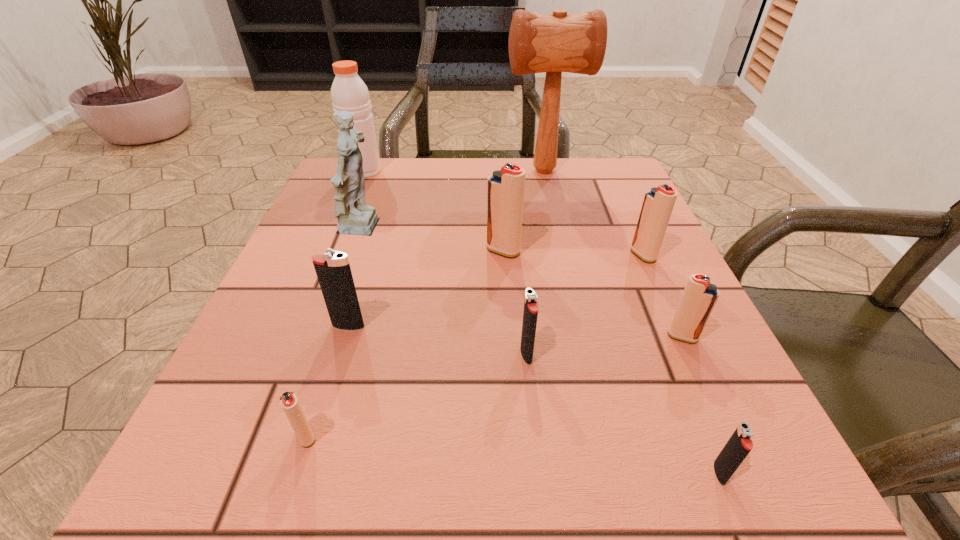
Find the location of a particular element. Image resolution: width=960 pixels, height=540 pixels. figurine that is at the left edge is located at coordinates (354, 217).

Find the location of a particular element. mallet that is at the right edge is located at coordinates (554, 43).

You are a GUI agent. You are given a task and a screenshot of the screen. Output one action in this format:
    pyautogui.click(x=<x>, y=<y>)
    Task: Click on the object located at the far left corner
    This screenshot has width=960, height=540.
    Given the screenshot: What is the action you would take?
    (349, 93)

Find the location of a particular element. The width and height of the screenshot is (960, 540). object present at the near left corner is located at coordinates (288, 400).

Locate an element on the screen. The height and width of the screenshot is (540, 960). object located in the far right corner section of the desktop is located at coordinates (554, 43).

Locate an element on the screen. This screenshot has width=960, height=540. object present at the near right corner is located at coordinates 739,445.

The image size is (960, 540). In order to click on vacant area at the far edge of the desktop in this screenshot , I will do `click(483, 190)`.

In the image, there is a desktop. Find the location of `vacant space at the near edge`. vacant space at the near edge is located at coordinates (308, 498).

Locate an element on the screen. The width and height of the screenshot is (960, 540). free space at the left edge is located at coordinates [251, 393].

At what (x,y) coordinates should I click in order to perform the action: click on free space at the right edge. Please return your answer as a coordinate pair (x, y). Looking at the image, I should click on (677, 270).